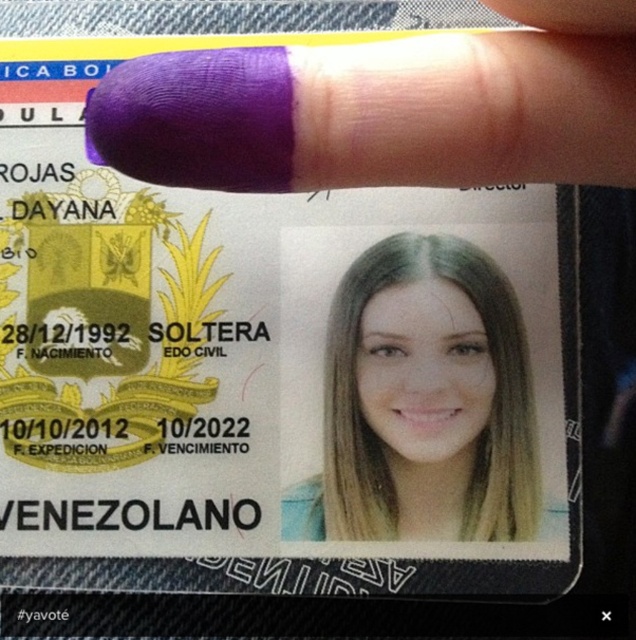
Between purple matte nail at upper center and blonde hair at center, which one has less height?

purple matte nail at upper center

Between point (181, 77) and point (530, 513), which one is positioned behind?

Positioned behind is point (530, 513).

In order to click on purple matte nail at upper center in this screenshot , I will do `click(385, 108)`.

Where is `purple matte nail at upper center`? Image resolution: width=636 pixels, height=640 pixels. purple matte nail at upper center is located at coordinates (385, 108).